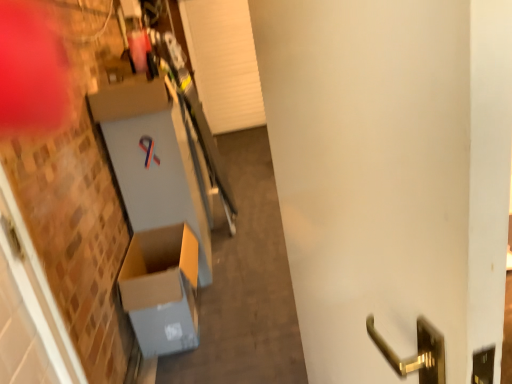
Question: From a real-world perspective, relative to brown cardboard box at lower left, is white glossy door handle at center right vertically above or below?

Choices:
 (A) below
 (B) above

Answer: (B)

Question: In the image, is white glossy door handle at center right positioned in front of or behind brown cardboard box at lower left?

Choices:
 (A) behind
 (B) front

Answer: (B)

Question: Considering the positions of point (439, 253) and point (122, 284), is point (439, 253) closer or farther from the camera than point (122, 284)?

Choices:
 (A) closer
 (B) farther

Answer: (A)

Question: In terms of width, does brown cardboard box at lower left look wider or thinner when compared to white glossy door handle at center right?

Choices:
 (A) thin
 (B) wide

Answer: (B)

Question: From a real-world perspective, relative to white glossy door handle at center right, is brown cardboard box at lower left vertically above or below?

Choices:
 (A) below
 (B) above

Answer: (A)

Question: From the image's perspective, is brown cardboard box at lower left positioned above or below white glossy door handle at center right?

Choices:
 (A) above
 (B) below

Answer: (B)

Question: Considering their positions, is brown cardboard box at lower left located in front of or behind white glossy door handle at center right?

Choices:
 (A) front
 (B) behind

Answer: (B)